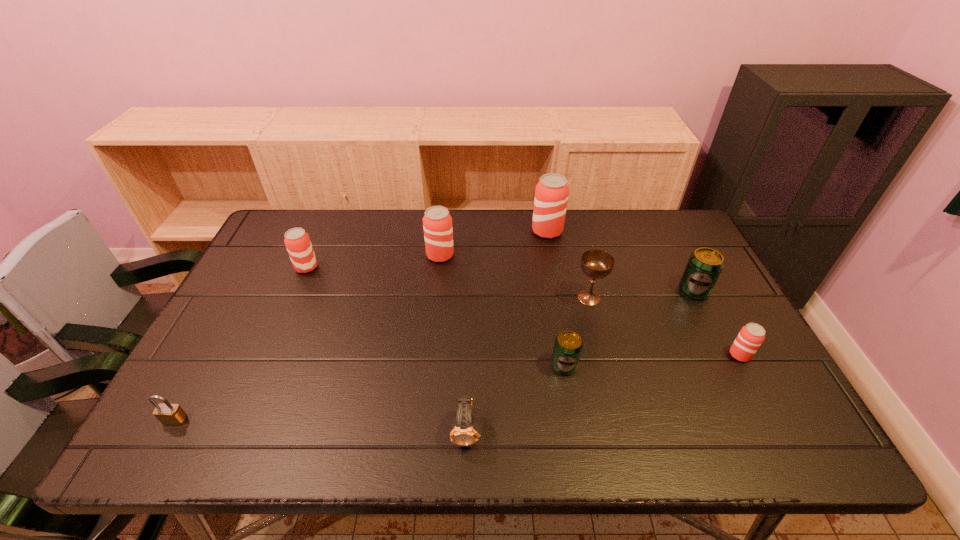
This screenshot has width=960, height=540. Find the location of `the smaller green beer can`. the smaller green beer can is located at coordinates click(568, 345).

Where is `the smallest orange beer can`? The width and height of the screenshot is (960, 540). the smallest orange beer can is located at coordinates click(x=751, y=336).

Where is `the rightmost orange beer can`? This screenshot has height=540, width=960. the rightmost orange beer can is located at coordinates (751, 336).

Find the location of `the leftmost object`. the leftmost object is located at coordinates (168, 414).

Find the location of `the fourth object from left to right`. the fourth object from left to right is located at coordinates (463, 434).

Locate an element on the screen. Image resolution: width=960 pixels, height=540 pixels. gold watch is located at coordinates (463, 434).

You are a GUI agent. You are given a task and a screenshot of the screen. Output one action in this format:
    pyautogui.click(x=<x>, y=<y>)
    Task: Click on the vacant space situated on the front of the tallest beer can
    
    Given the screenshot: What is the action you would take?
    pyautogui.click(x=551, y=254)

What are the coordinates of `vacant space located on the right of the third orange beer can from right to left` in the screenshot? It's located at (536, 255).

You are a GUI agent. You are given a task and a screenshot of the screen. Output one action in this format:
    pyautogui.click(x=<x>, y=<y>)
    Task: Click on the vacant region located on the front of the chalice
    
    Given the screenshot: What is the action you would take?
    pyautogui.click(x=610, y=379)

This screenshot has height=540, width=960. I want to click on vacant region located 0.150m on the right of the leftmost orange beer can, so click(x=367, y=267).